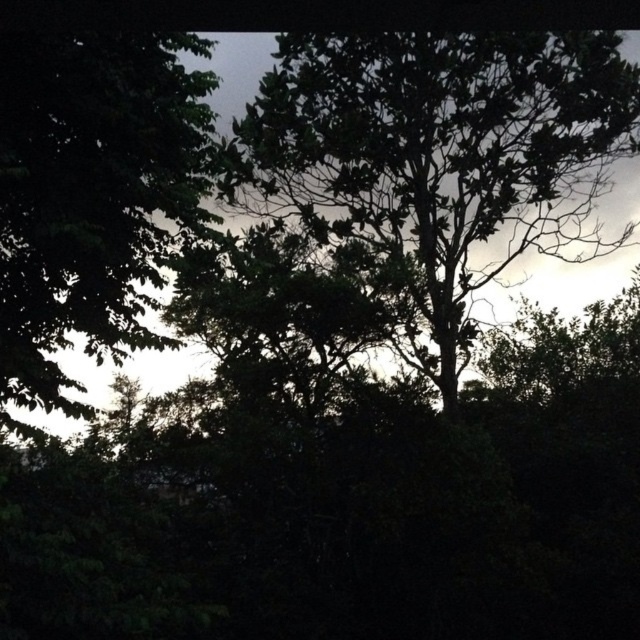
Question: Does dark green leafy tree at center appear under green leafy tree at left?

Choices:
 (A) yes
 (B) no

Answer: (B)

Question: Is dark green leafy tree at center positioned before green leafy tree at left?

Choices:
 (A) no
 (B) yes

Answer: (A)

Question: Is dark green leafy tree at center thinner than green leafy tree at left?

Choices:
 (A) yes
 (B) no

Answer: (A)